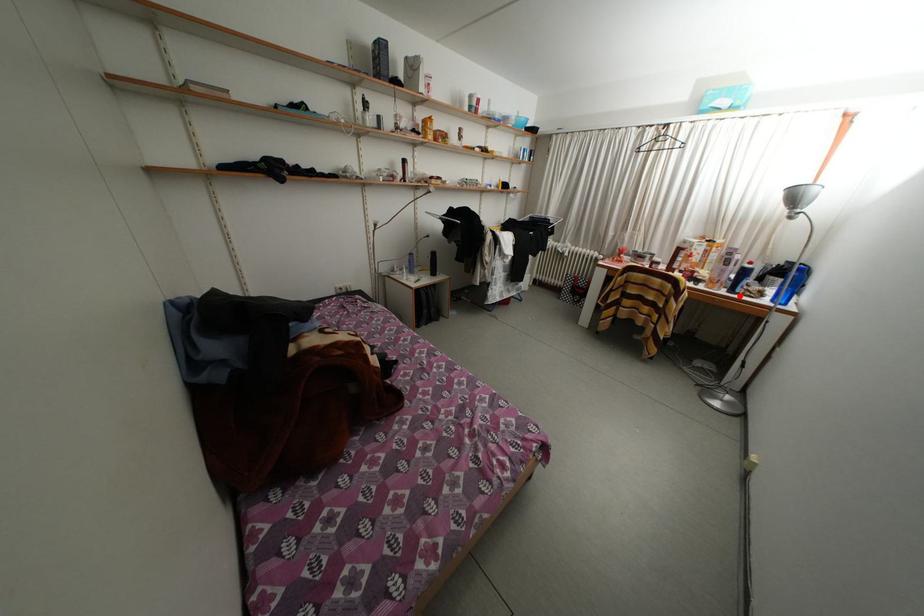
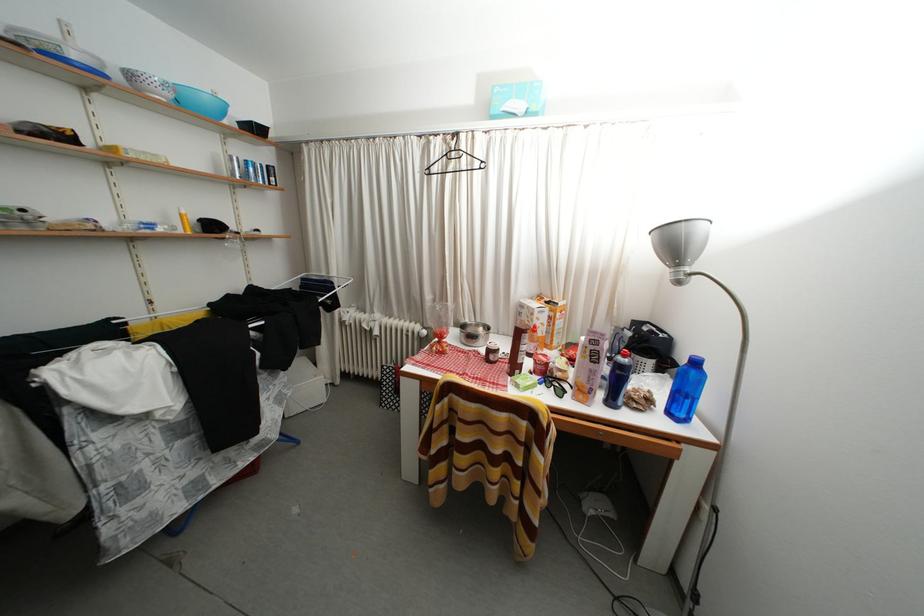
The point at the highlighted location is marked in the first image. Where is the corresponding point in the second image?

(618, 408)